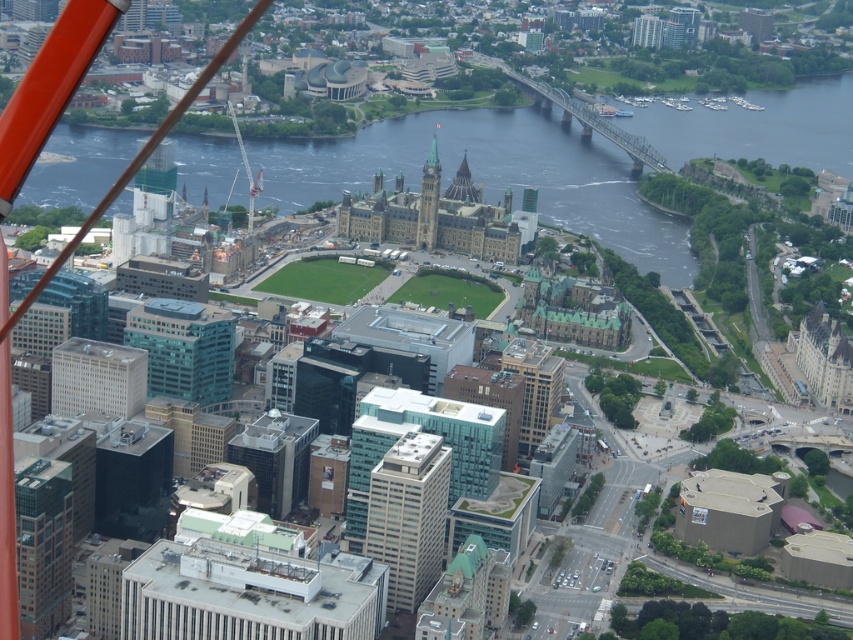
You are a city planner analyzing this aerial view. You need to determine which of the two elements, the dark blue water at center or the beige concrete building at center, occupies more space in the image. Based on the scene description, which one is larger?

The dark blue water at center has a larger size compared to the beige concrete building at center, so the dark blue water at center occupies more space in the image.

You are a city planner analyzing the aerial view of the city. You need to determine if the dark blue water at center can accommodate a new floating park that requires a minimum width of 50 meters. The beige concrete building at center is known to be 30 meters wide. Can the water at center support the park?

The dark blue water at center has a width larger than the beige concrete building at center, which is 30 meters wide. Therefore, the water is wider than 30 meters. Since the required width for the floating park is 50 meters, it depends on whether the water is at least 50 meters wide. However, the exact width isn not provided, so we cannot confirm if it meets the requirement.